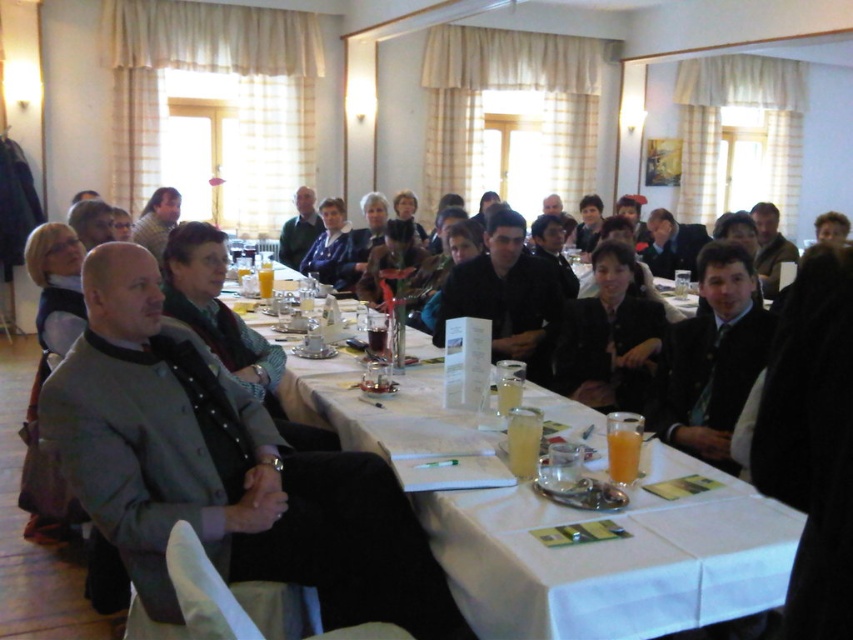
Does point (587, 381) come farther from viewer compared to point (309, 218)?

No, (587, 381) is closer to viewer.

Does black fabric jacket at center lie behind matte black jacket at center?

No, it is not.

Is point (606, 346) less distant than point (288, 221)?

Yes, it is in front of point (288, 221).

You are a GUI agent. You are given a task and a screenshot of the screen. Output one action in this format:
    pyautogui.click(x=<x>, y=<y>)
    Task: Click on the black fabric jacket at center
    The width and height of the screenshot is (853, 640).
    Given the screenshot: What is the action you would take?
    pyautogui.click(x=608, y=337)

Who is shorter, white cloth table at center or black matte jacket at center?

white cloth table at center is shorter.

Is white cloth table at center smaller than black matte jacket at center?

Incorrect, white cloth table at center is not smaller in size than black matte jacket at center.

Measure the distance between point (x=479, y=496) and camera.

They are 6.32 feet apart.

Locate an element on the screen. white cloth table at center is located at coordinates point(614,557).

Is black fabric jacket at center positioned in front of green textured sweater at upper center?

That is True.

Which is behind, point (619, 346) or point (136, 237)?

The point (136, 237) is behind.

I want to click on black fabric jacket at center, so click(608, 337).